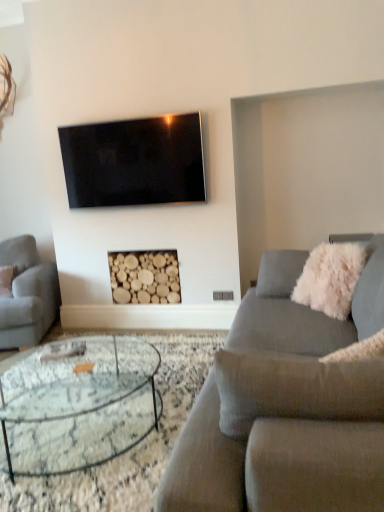
At what (x,y) coordinates should I click in order to perform the action: click on blank area beneath clear glass coffee table at center (from a real-world perspective). Please return your answer as a coordinate pair (x, y). This screenshot has height=512, width=384. Looking at the image, I should click on (70, 415).